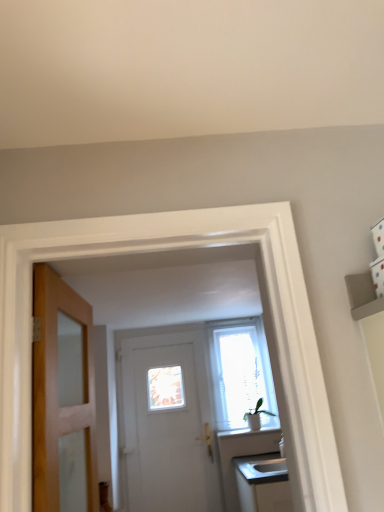
What do you see at coordinates (167, 426) in the screenshot?
I see `white matte door at center` at bounding box center [167, 426].

Where is `white matte door at center`? white matte door at center is located at coordinates (167, 426).

Identify the location of white matte door at center. click(x=167, y=426).